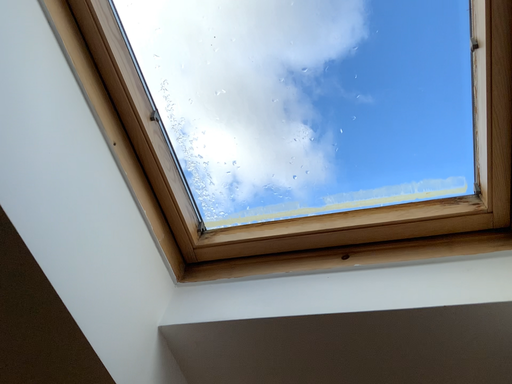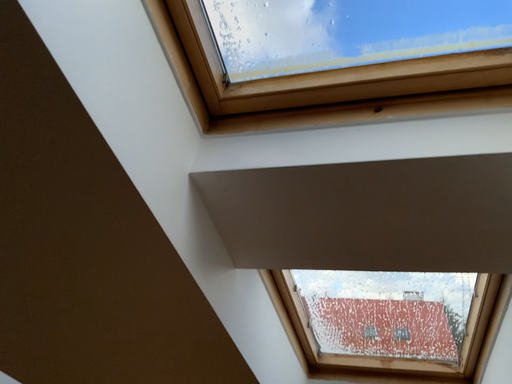
Question: Which way did the camera rotate in the video?

Choices:
 (A) rotated downward
 (B) rotated upward

Answer: (A)